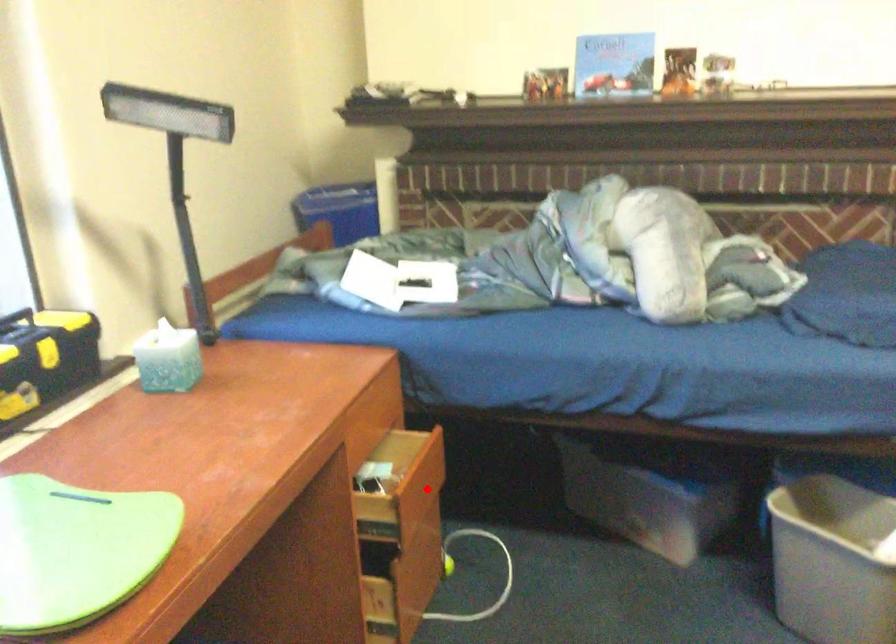
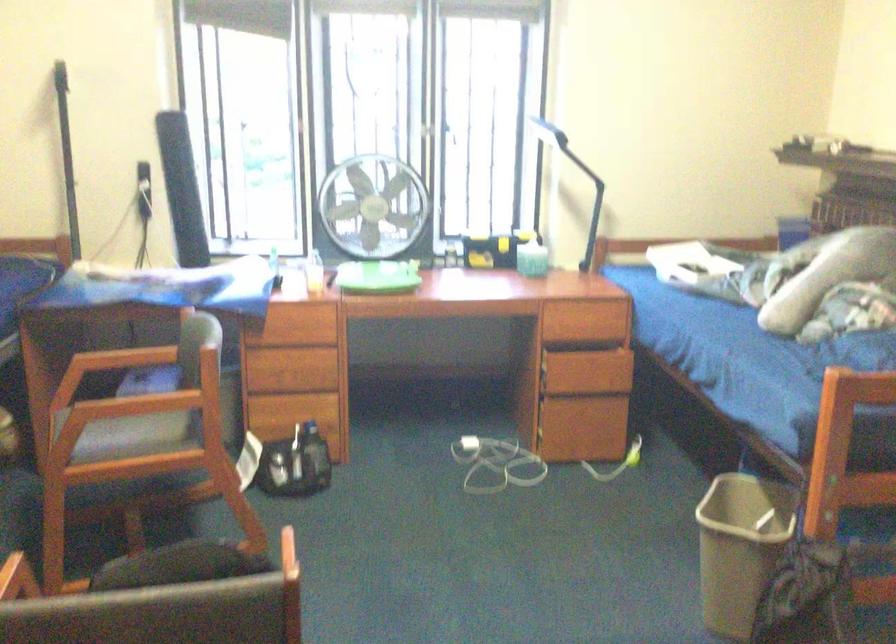
Question: I am providing you with two images of the same scene from different viewpoints. Image1 has a red point marked. In image2, the corresponding 3D location appears at what relative position? Reply with the corresponding letter.

Choices:
 (A) Closer
 (B) Farther

Answer: (B)